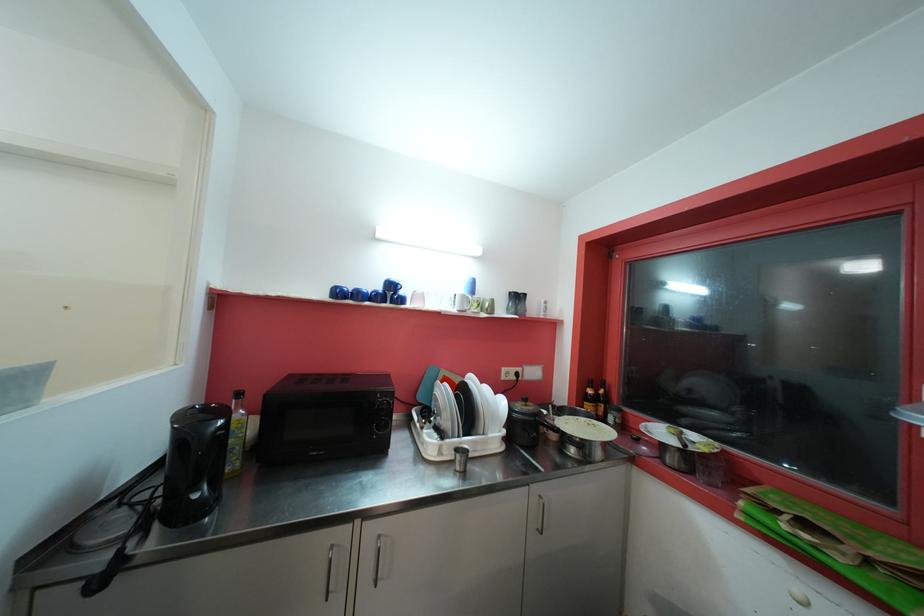
Where would you lift the pot lid handle? Please return your answer as a coordinate pair (x, y).

(524, 400)